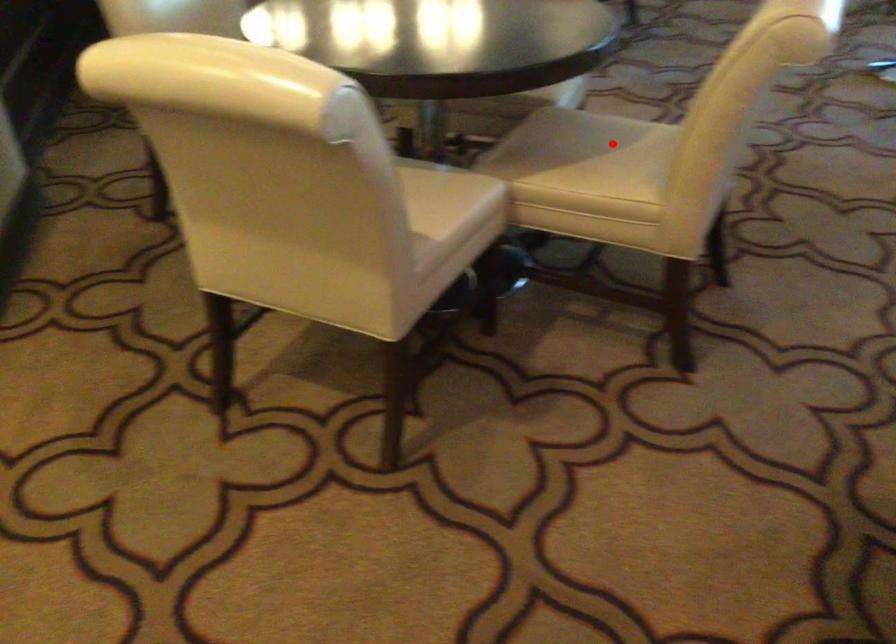
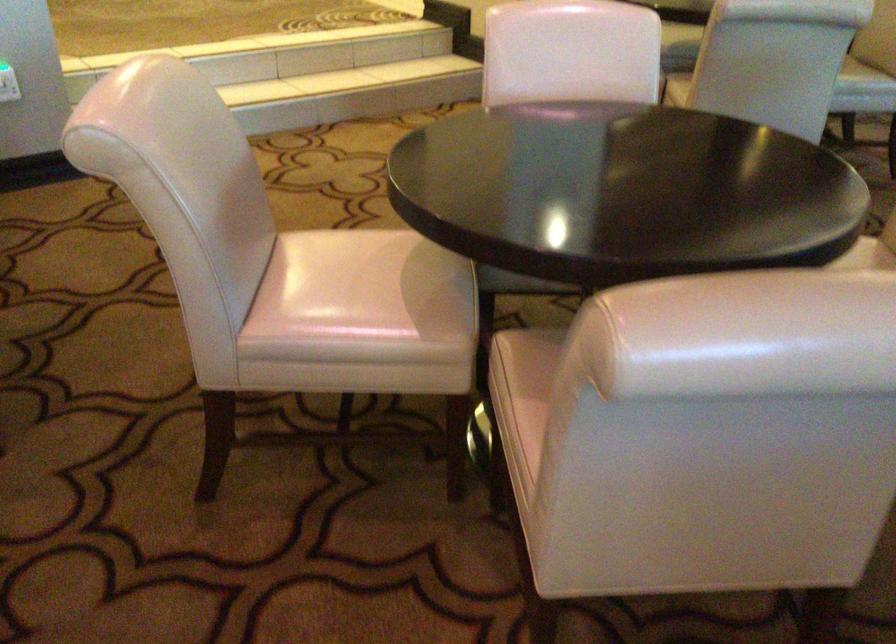
Question: I am providing you with two images of the same scene from different viewpoints. A red point is marked on the first image. Can you still see the location of the red point in image 2?

Choices:
 (A) Yes
 (B) No

Answer: (B)